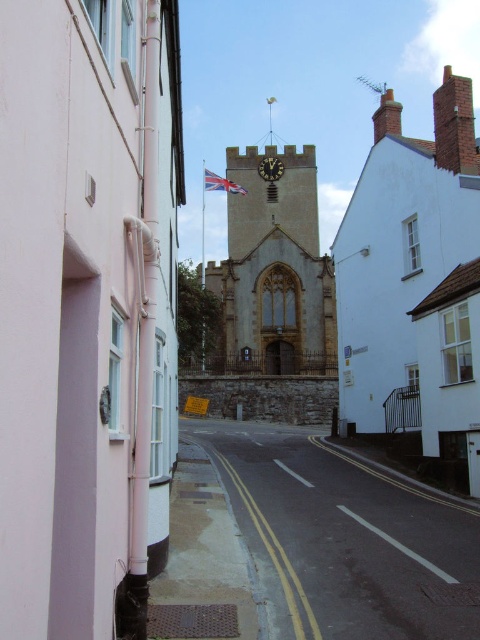
Question: Which point is closer to the camera taking this photo?

Choices:
 (A) (224, 182)
 (B) (431, 177)

Answer: (B)

Question: Which point appears farthest from the camera in this image?

Choices:
 (A) (285, 554)
 (B) (369, 256)

Answer: (B)

Question: Is white smooth wall at left further to the viewer compared to gold metallic clock at center?

Choices:
 (A) no
 (B) yes

Answer: (A)

Question: Is smooth asphalt road at center below red fabric flag at center?

Choices:
 (A) no
 (B) yes

Answer: (B)

Question: Which is nearer to the red fabric flag at center?

Choices:
 (A) white brick church at center
 (B) smooth asphalt road at center
 (C) stone clock tower at center

Answer: (C)

Question: Is smooth asphalt road at center to the right of red fabric flag at center from the viewer's perspective?

Choices:
 (A) yes
 (B) no

Answer: (A)